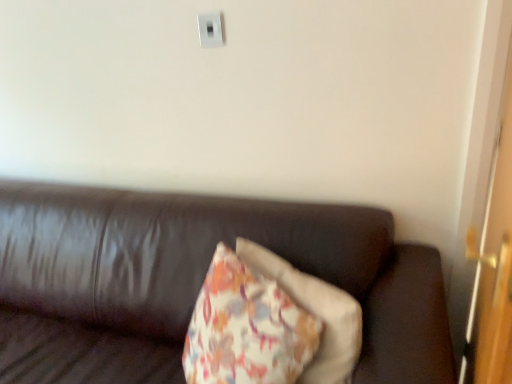
Question: Does leather couch at center have a greater height compared to white plastic switch at upper center?

Choices:
 (A) yes
 (B) no

Answer: (A)

Question: Does leather couch at center have a larger size compared to white plastic switch at upper center?

Choices:
 (A) no
 (B) yes

Answer: (B)

Question: Considering the relative positions of leather couch at center and white plastic switch at upper center in the image provided, is leather couch at center to the left of white plastic switch at upper center from the viewer's perspective?

Choices:
 (A) yes
 (B) no

Answer: (A)

Question: Is leather couch at center beside white plastic switch at upper center?

Choices:
 (A) yes
 (B) no

Answer: (B)

Question: Is leather couch at center shorter than white plastic switch at upper center?

Choices:
 (A) yes
 (B) no

Answer: (B)

Question: From a real-world perspective, is leather couch at center physically located above or below white plastic switch at upper center?

Choices:
 (A) below
 (B) above

Answer: (A)

Question: Is leather couch at center bigger or smaller than white plastic switch at upper center?

Choices:
 (A) small
 (B) big

Answer: (B)

Question: From the image's perspective, is leather couch at center above or below white plastic switch at upper center?

Choices:
 (A) above
 (B) below

Answer: (B)

Question: Is leather couch at center spatially inside white plastic switch at upper center, or outside of it?

Choices:
 (A) inside
 (B) outside

Answer: (B)

Question: Choose the correct answer: Is wooden door at right inside white plastic switch at upper center or outside it?

Choices:
 (A) inside
 (B) outside

Answer: (B)

Question: Is wooden door at right in front of or behind white plastic switch at upper center in the image?

Choices:
 (A) front
 (B) behind

Answer: (A)

Question: Would you say wooden door at right is to the left or to the right of white plastic switch at upper center in the picture?

Choices:
 (A) right
 (B) left

Answer: (A)

Question: Is wooden door at right taller or shorter than white plastic switch at upper center?

Choices:
 (A) short
 (B) tall

Answer: (B)

Question: Considering the positions of point (212, 14) and point (35, 344), is point (212, 14) closer or farther from the camera than point (35, 344)?

Choices:
 (A) closer
 (B) farther

Answer: (A)

Question: From a real-world perspective, is white plastic switch at upper center above or below leather couch at center?

Choices:
 (A) below
 (B) above

Answer: (B)